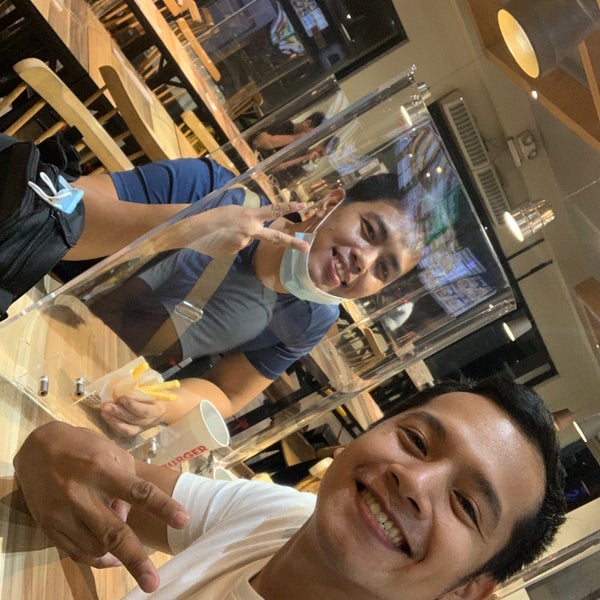
This screenshot has width=600, height=600. I want to click on glass, so click(382, 189).